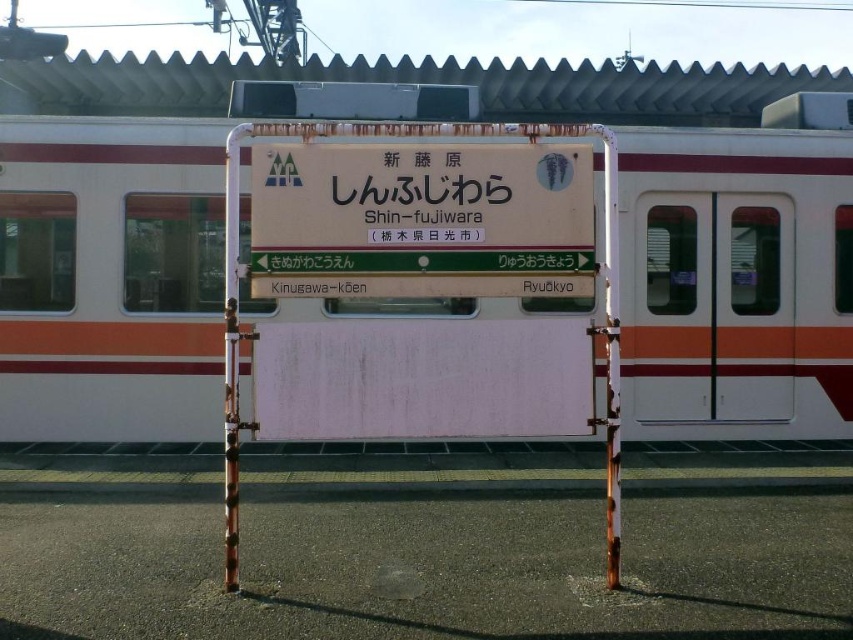
Question: Which object appears farthest from the camera in this image?

Choices:
 (A) matte white sign at center
 (B) white matte train at center

Answer: (A)

Question: Does white matte train at center appear on the right side of matte white sign at center?

Choices:
 (A) yes
 (B) no

Answer: (A)

Question: Where is white matte train at center located in relation to matte white sign at center in the image?

Choices:
 (A) right
 (B) left

Answer: (A)

Question: Is white matte train at center behind matte white sign at center?

Choices:
 (A) no
 (B) yes

Answer: (A)